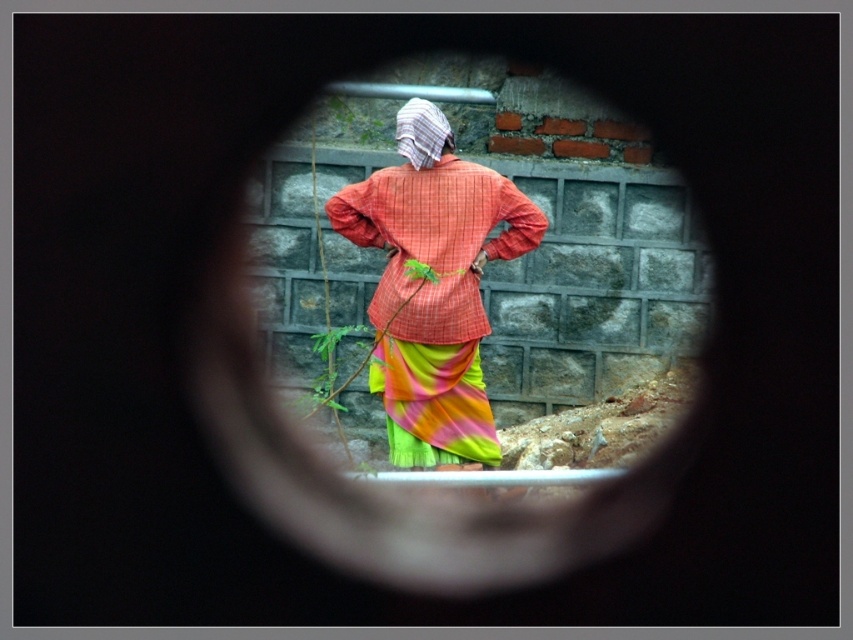
Question: Among these points, which one is farthest from the camera?

Choices:
 (A) (363, 205)
 (B) (445, 435)

Answer: (A)

Question: Is matte glass hole at center bigger than textured orange shirt at center?

Choices:
 (A) no
 (B) yes

Answer: (B)

Question: Is matte glass hole at center to the right of textured orange shirt at center from the viewer's perspective?

Choices:
 (A) yes
 (B) no

Answer: (A)

Question: Among these points, which one is nearest to the camera?

Choices:
 (A) (685, 282)
 (B) (352, 188)

Answer: (B)

Question: Among these objects, which one is farthest from the camera?

Choices:
 (A) matte glass hole at center
 (B) textured orange shirt at center

Answer: (A)

Question: Where is matte glass hole at center located in relation to textured orange shirt at center in the image?

Choices:
 (A) above
 (B) below

Answer: (A)